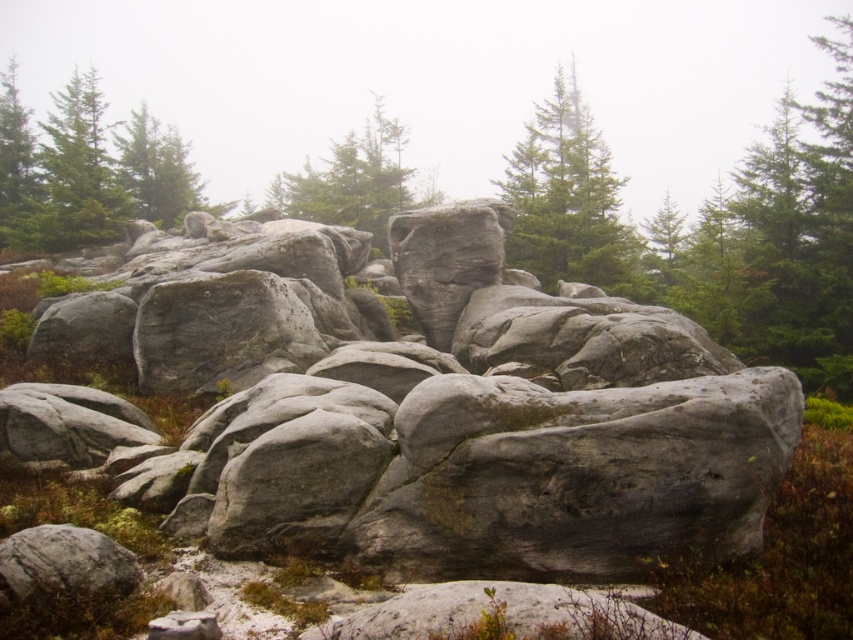
Question: Can you confirm if green matte tree at upper center is positioned to the left of green matte tree at center?

Choices:
 (A) yes
 (B) no

Answer: (B)

Question: Among these objects, which one is farthest from the camera?

Choices:
 (A) green matte tree at center
 (B) green matte tree at upper center
 (C) gray rough rock at center
 (D) green matte tree at upper left

Answer: (D)

Question: From the image, what is the correct spatial relationship of gray rough rock at center in relation to green matte tree at upper center?

Choices:
 (A) left
 (B) right

Answer: (A)

Question: Which object is closer to the camera taking this photo?

Choices:
 (A) green matte tree at upper center
 (B) gray rough rock at center

Answer: (B)

Question: Is green matte tree at upper left thinner than green matte tree at upper center?

Choices:
 (A) yes
 (B) no

Answer: (B)

Question: Among these objects, which one is nearest to the camera?

Choices:
 (A) green matte tree at upper left
 (B) green matte tree at upper center
 (C) green matte tree at center

Answer: (B)